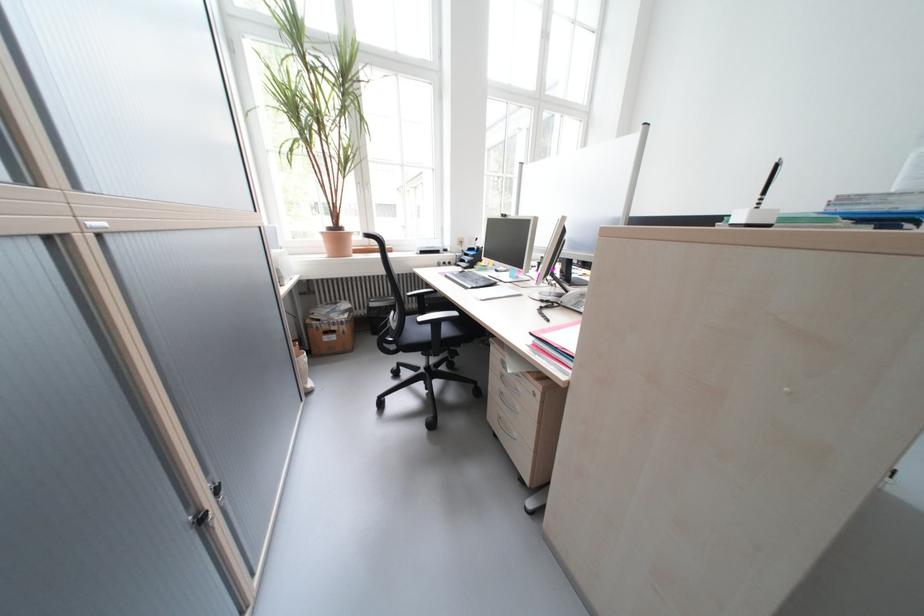
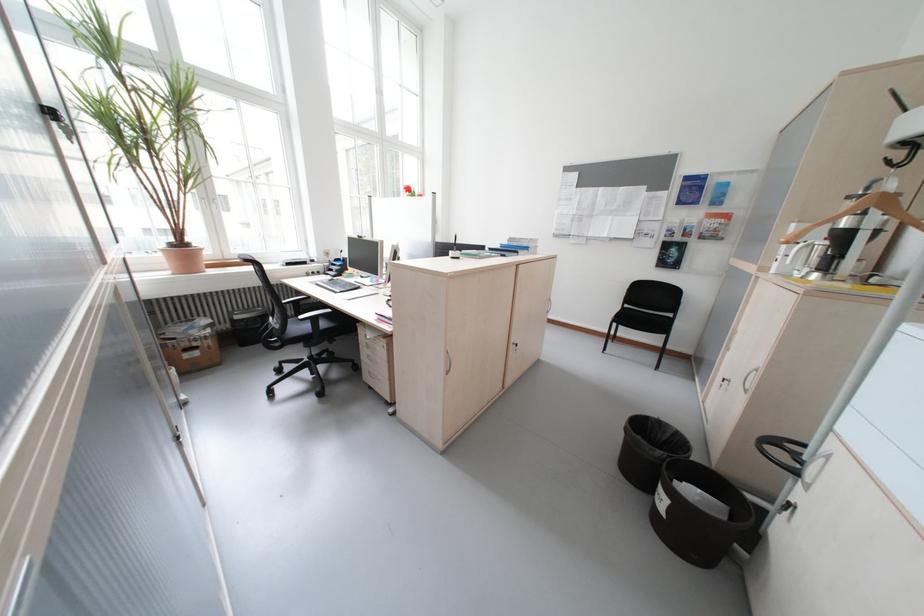
Question: The camera is either moving clockwise (left) or counter-clockwise (right) around the object. The first image is from the beginning of the video and the second image is from the end. Is the camera moving left or right when shooting the video?

Choices:
 (A) Left
 (B) Right

Answer: (A)